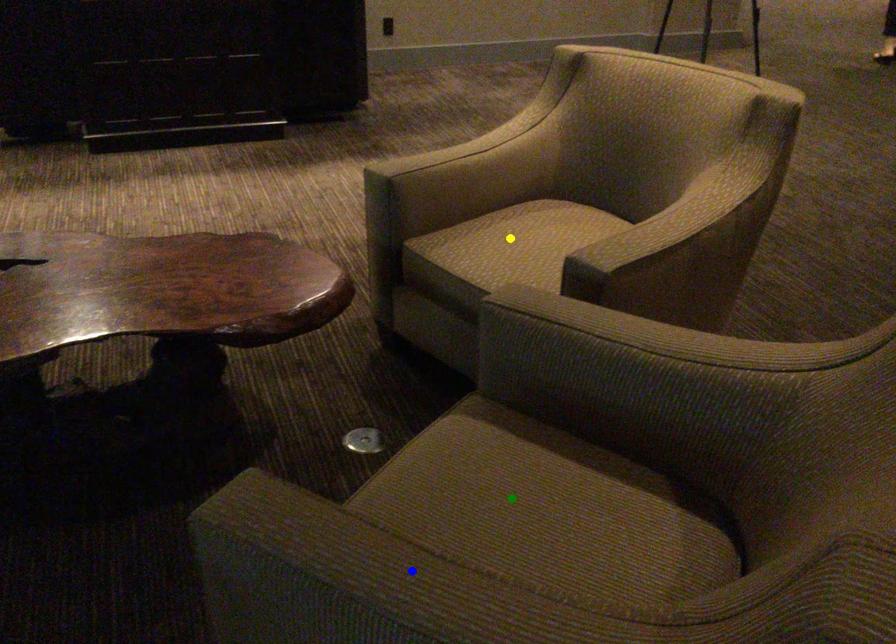
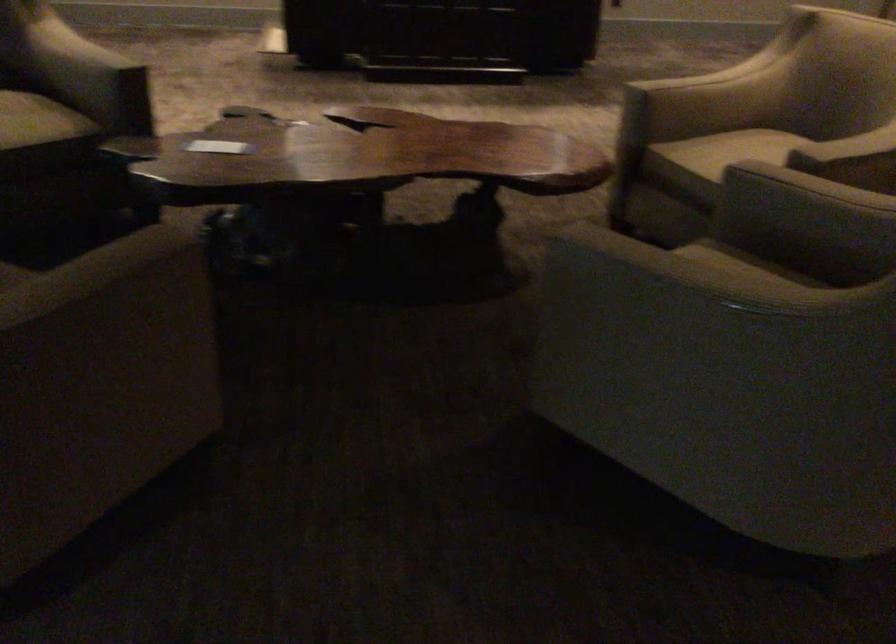
I am providing you with two images of the same scene from different viewpoints. Three points are marked in image1. Which point corresponds to a part or object that is occluded in image2?In image1, three points are marked. Which of them correspond to a part or object that is occluded in image2?Among the three points shown in image1, which one corresponds to a part or object that is no longer visible due to occlusion in image2?

Invisible in image2: green point.